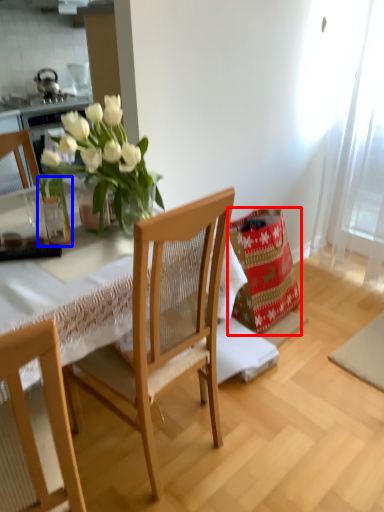
Question: Among these objects, which one is farthest to the camera, material (highlighted by a red box) or glass vase (highlighted by a blue box)?

Choices:
 (A) material
 (B) glass vase

Answer: (A)